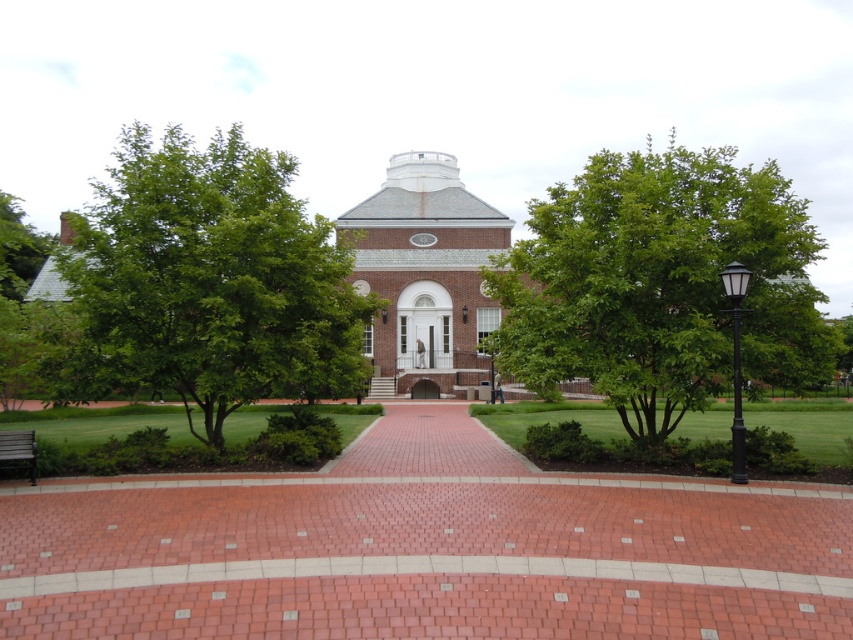
You are standing at the entrance of the building and looking down the brick pathway. There are two points marked on the pathway. Which point is closer to you, point (99, 317) or point (387, 378)?

Point (99, 317) is closer to the camera than point (387, 378), so the point closer to you is point (99, 317).

You are standing at the entrance of the building and want to walk towards the end of the brick pathway. Which point, point [776,598] or point [728,362], would you reach first?

Point [776,598] is in front of point [728,362], so you would reach point [776,598] first as it is closer to your starting position at the entrance.

You are standing at the end of the brick pathway and want to take a photo of the green leafy tree at left and the brick building at center. Which object should you zoom in on to capture both in the frame without moving your camera?

The green leafy tree at left is larger in size than the brick building at center, so you should zoom in on the brick building at center to ensure both fit in the frame.